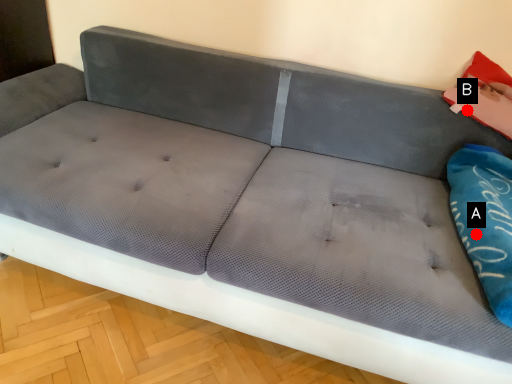
Question: Two points are circled on the image, labeled by A and B beside each circle. Among these points, which one is nearest to the camera?

Choices:
 (A) A is closer
 (B) B is closer

Answer: (A)